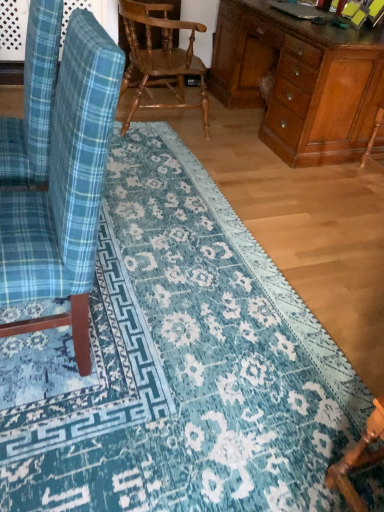
Question: Could you tell me if wooden desk at right is turned towards wooden chair at lower right, placed as the 2th chair when sorted from front to back?

Choices:
 (A) yes
 (B) no

Answer: (B)

Question: From the image's perspective, is wooden desk at right under wooden chair at lower right, which is the 2th chair in back-to-front order?

Choices:
 (A) no
 (B) yes

Answer: (A)

Question: Does wooden desk at right touch wooden chair at lower right, which is the 2th chair in back-to-front order?

Choices:
 (A) no
 (B) yes

Answer: (A)

Question: Does wooden desk at right have a larger size compared to wooden chair at lower right, which is the 2th chair in back-to-front order?

Choices:
 (A) yes
 (B) no

Answer: (A)

Question: Does wooden desk at right have a lesser width compared to wooden chair at lower right, the third chair in the top-to-bottom sequence?

Choices:
 (A) yes
 (B) no

Answer: (B)

Question: From a real-world perspective, is wooden textured chair at center, which appears as the 1th chair when viewed from the back, positioned above or below wooden desk at right?

Choices:
 (A) below
 (B) above

Answer: (B)

Question: Would you say wooden textured chair at center, positioned as the first chair in top-to-bottom order, is inside or outside wooden desk at right?

Choices:
 (A) outside
 (B) inside

Answer: (A)

Question: Does point (180, 84) appear closer or farther from the camera than point (324, 122)?

Choices:
 (A) farther
 (B) closer

Answer: (A)

Question: Considering their positions, is wooden textured chair at center, which ranks as the 3th chair in front-to-back order, located in front of or behind wooden desk at right?

Choices:
 (A) front
 (B) behind

Answer: (A)

Question: From the image's perspective, is wooden textured chair at center, arranged as the 3th chair when ordered from the bottom, positioned above or below wooden chair at lower right, which is the 1th chair from bottom to top?

Choices:
 (A) above
 (B) below

Answer: (A)

Question: Based on their sizes in the image, would you say wooden textured chair at center, positioned as the first chair in top-to-bottom order, is bigger or smaller than wooden chair at lower right, which is the 2th chair in back-to-front order?

Choices:
 (A) small
 (B) big

Answer: (B)

Question: From a real-world perspective, is wooden textured chair at center, which ranks as the 3th chair in front-to-back order, positioned above or below wooden chair at lower right, which is the 2th chair in back-to-front order?

Choices:
 (A) below
 (B) above

Answer: (B)

Question: Relative to wooden chair at lower right, which is the 1th chair from bottom to top, is wooden textured chair at center, which appears as the 1th chair when viewed from the back, in front or behind?

Choices:
 (A) front
 (B) behind

Answer: (B)

Question: Does point (340, 490) appear closer or farther from the camera than point (115, 73)?

Choices:
 (A) farther
 (B) closer

Answer: (A)

Question: Based on their sizes in the image, would you say wooden chair at lower right, which is the 1th chair from bottom to top, is bigger or smaller than blue plaid fabric chair at left, the 3th chair in the back-to-front sequence?

Choices:
 (A) big
 (B) small

Answer: (B)